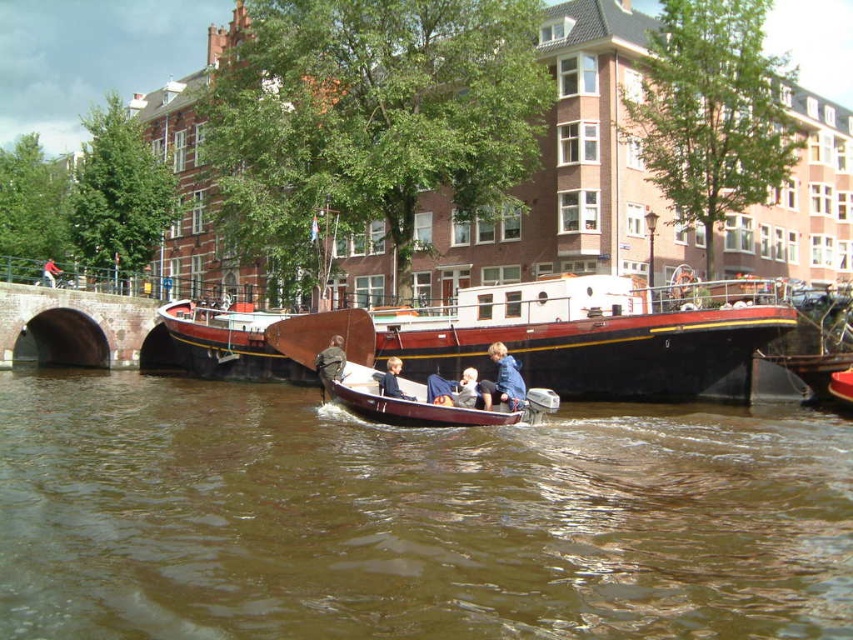
Which is behind, point (666, 620) or point (45, 262)?

The point (45, 262) is behind.

Which of these two, brown water at center or red fabric cap at upper center, stands shorter?

With less height is red fabric cap at upper center.

This screenshot has height=640, width=853. Find the location of `brown water at center`. brown water at center is located at coordinates (409, 518).

Is rustic wood boat at center smaller than dark brown stone bridge at lower left?

Incorrect, rustic wood boat at center is not smaller in size than dark brown stone bridge at lower left.

Can you confirm if rustic wood boat at center is wider than dark brown stone bridge at lower left?

Yes.

Where is `rustic wood boat at center`? rustic wood boat at center is located at coordinates (532, 336).

In the scene shown: Is brown leather jacket at center bigger than red fabric cap at upper center?

No.

Identify the location of brown leather jacket at center. The width and height of the screenshot is (853, 640). (329, 362).

Is point (343, 349) positioned behind point (55, 276)?

No, (343, 349) is in front of (55, 276).

Image resolution: width=853 pixels, height=640 pixels. Identify the location of brown leather jacket at center. (329, 362).